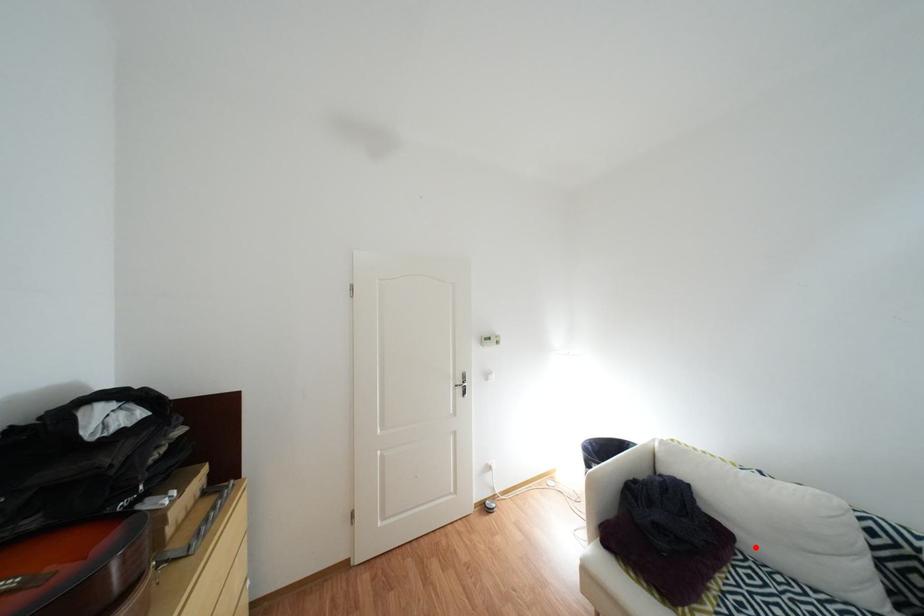
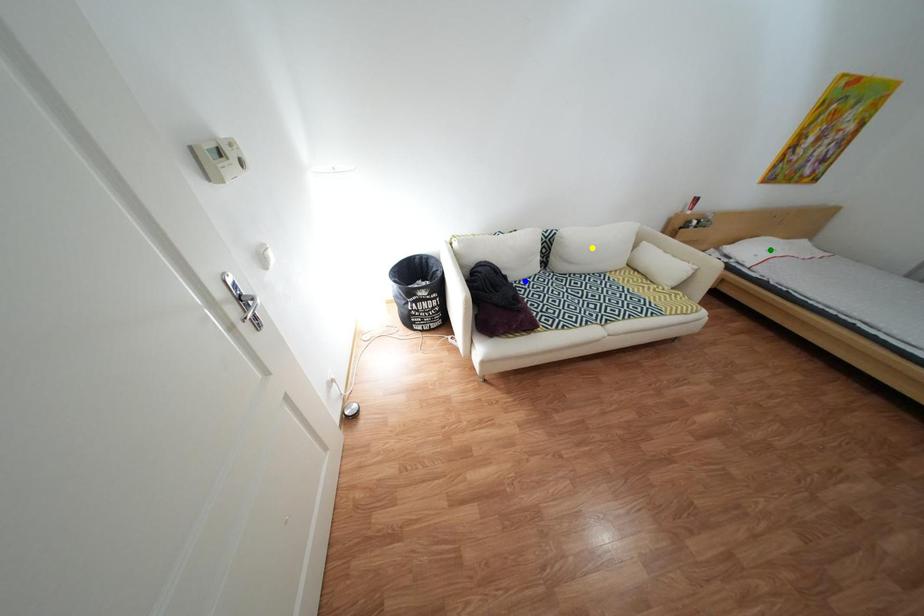
Question: I am providing you with two images of the same scene from different viewpoints. A red point is marked on the first image. You are given multiple points on the second image. Which spot in image 2 lines up with the point in image 1?

Choices:
 (A) yellow point
 (B) green point
 (C) blue point

Answer: (C)